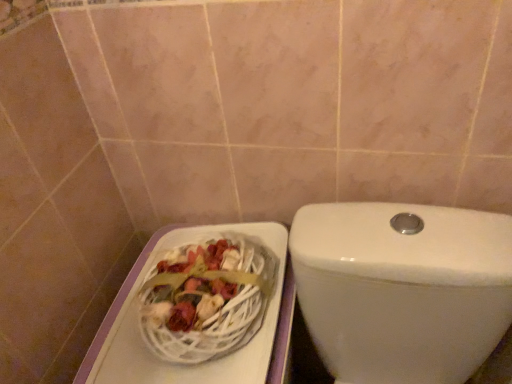
Question: Is point (225, 269) closer or farther from the camera than point (333, 322)?

Choices:
 (A) closer
 (B) farther

Answer: (A)

Question: In terms of height, does white wicker basket at lower left look taller or shorter compared to white glossy toilet at center?

Choices:
 (A) short
 (B) tall

Answer: (A)

Question: In terms of width, does white wicker basket at lower left look wider or thinner when compared to white glossy toilet at center?

Choices:
 (A) thin
 (B) wide

Answer: (A)

Question: Is white glossy toilet at center in front of or behind white wicker basket at lower left in the image?

Choices:
 (A) front
 (B) behind

Answer: (A)

Question: In terms of size, does white glossy toilet at center appear bigger or smaller than white wicker basket at lower left?

Choices:
 (A) big
 (B) small

Answer: (A)

Question: Considering the relative positions of white glossy toilet at center and white wicker basket at lower left in the image provided, is white glossy toilet at center to the left or to the right of white wicker basket at lower left?

Choices:
 (A) right
 (B) left

Answer: (A)

Question: From the image's perspective, is white glossy toilet at center located above or below white wicker basket at lower left?

Choices:
 (A) below
 (B) above

Answer: (A)